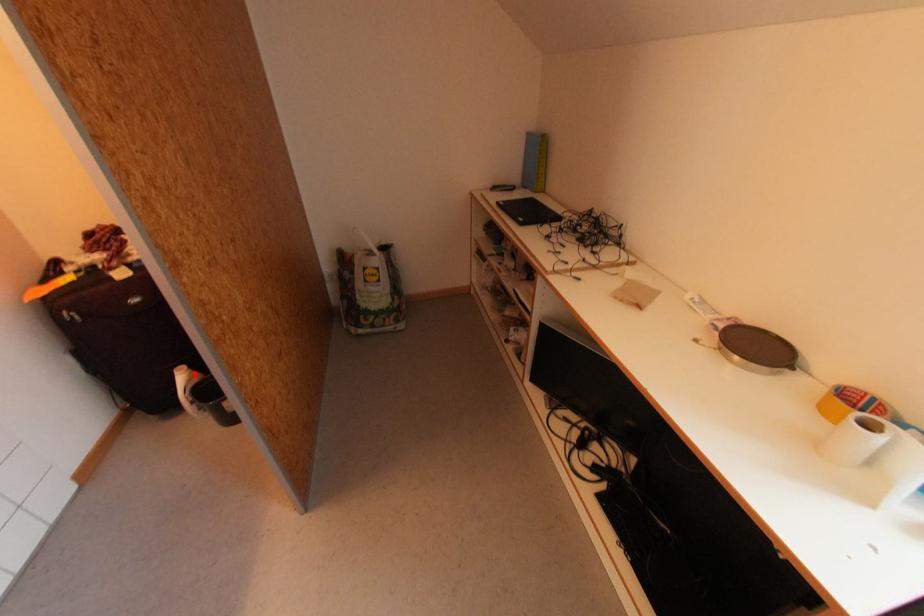
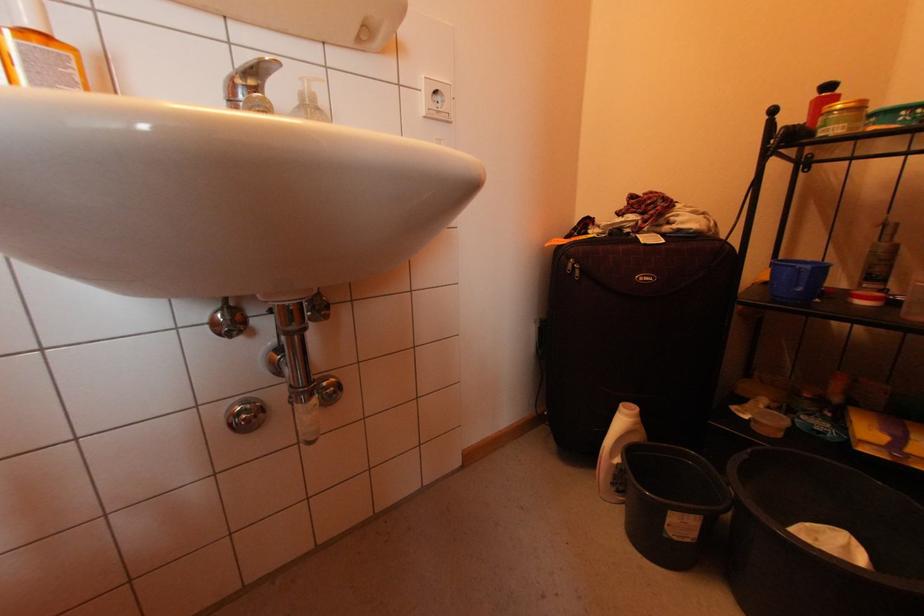
Question: I am providing you with two images of the same scene from different viewpoints. A red point is shown in image1. For the corresponding object point in image2, is it positioned nearer or farther from the camera?

Choices:
 (A) Nearer
 (B) Farther

Answer: (B)